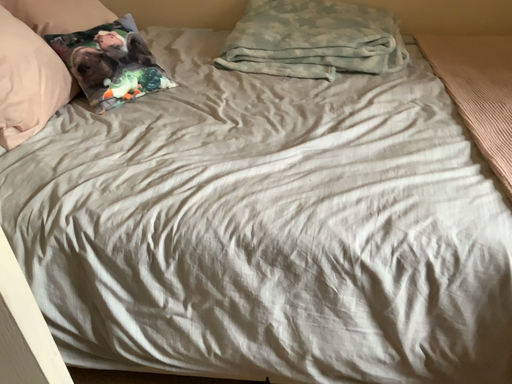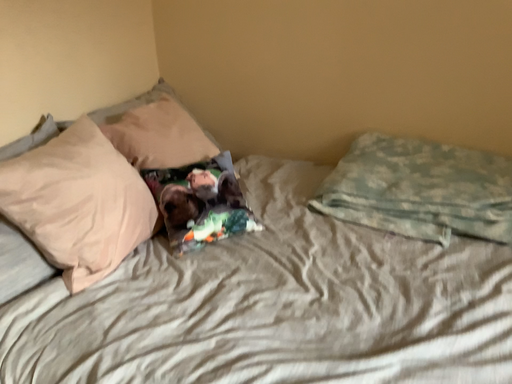
Question: Which way did the camera rotate in the video?

Choices:
 (A) rotated upward
 (B) rotated downward

Answer: (A)